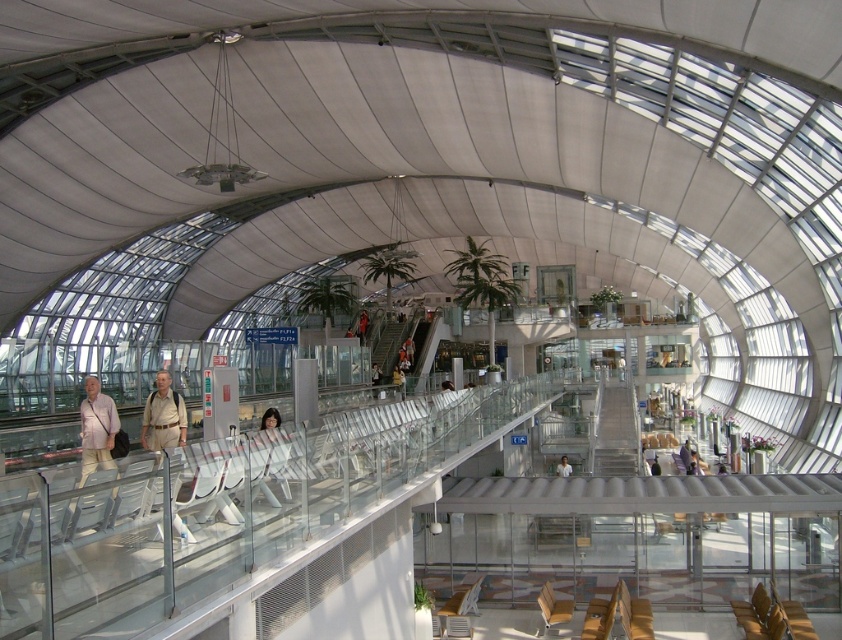
Which is more to the left, tan fabric pants at lower left or dark brown leather jacket at center?

Positioned to the left is dark brown leather jacket at center.

In the scene shown: Which of these two, tan fabric pants at lower left or dark brown leather jacket at center, stands taller?

Standing taller between the two is dark brown leather jacket at center.

Image resolution: width=842 pixels, height=640 pixels. I want to click on tan fabric pants at lower left, so click(163, 417).

Who is more distant from viewer, (x=361, y=310) or (x=561, y=464)?

Point (x=361, y=310)

Between dark brown leather jacket at center and white fabric shirt at center, which one is positioned higher?

dark brown leather jacket at center

Describe the element at coordinates (361, 324) in the screenshot. The width and height of the screenshot is (842, 640). I see `dark brown leather jacket at center` at that location.

Find the location of `dark brown leather jacket at center`. dark brown leather jacket at center is located at coordinates (361, 324).

Does point (105, 412) lie behind point (649, 470)?

No.

Between light beige shirt at center and dark gray fabric jacket at center, which one appears on the right side from the viewer's perspective?

dark gray fabric jacket at center

Who is more distant from viewer, [81,448] or [654,456]?

The point [654,456] is behind.

I want to click on light beige shirt at center, so click(x=96, y=428).